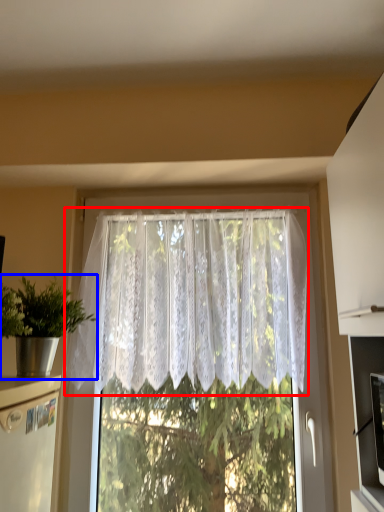
Question: Which of the following is the farthest to the observer, curtain (highlighted by a red box) or houseplant (highlighted by a blue box)?

Choices:
 (A) curtain
 (B) houseplant

Answer: (A)